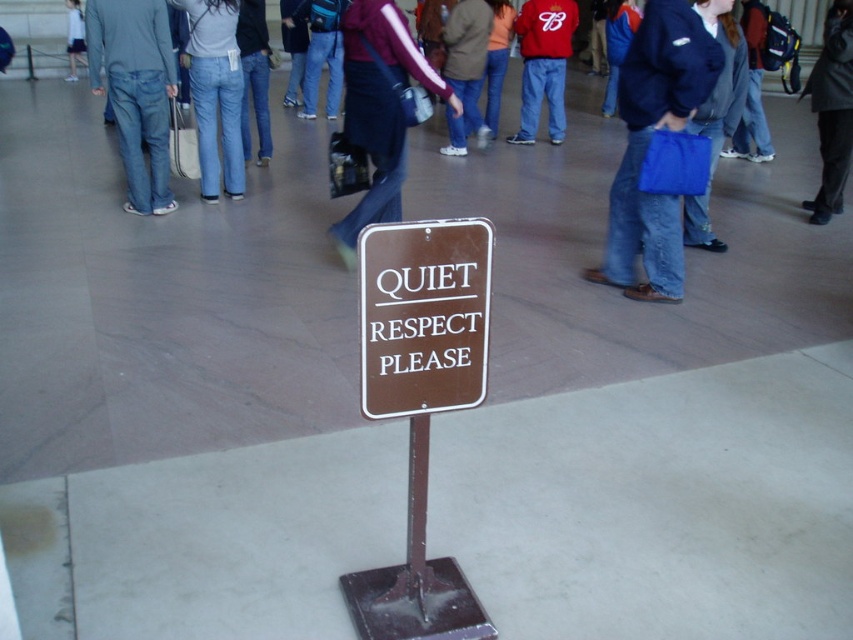
Is point (456, 300) positioned in front of point (824, 29)?

Yes, it is.

Between brown metal sign at center and dark gray jacket at center, which one is positioned lower?

brown metal sign at center is below.

Where is `brown metal sign at center`? brown metal sign at center is located at coordinates (422, 316).

Does denim jeans at center appear under red cotton hoodie at center?

Indeed, denim jeans at center is positioned under red cotton hoodie at center.

In the scene shown: Who is positioned more to the left, denim jeans at center or red cotton hoodie at center?

denim jeans at center is more to the left.

Who is more distant from viewer, [233,113] or [526,131]?

Point [526,131]

Find the location of a particular element. denim jeans at center is located at coordinates (215, 92).

From the picture: Does denim jeans at center have a lesser height compared to dark gray jacket at center?

Result: Correct, denim jeans at center is not as tall as dark gray jacket at center.

Which is in front, point (229, 33) or point (846, 45)?

Positioned in front is point (846, 45).

Where is `denim jeans at center`? This screenshot has height=640, width=853. denim jeans at center is located at coordinates (215, 92).